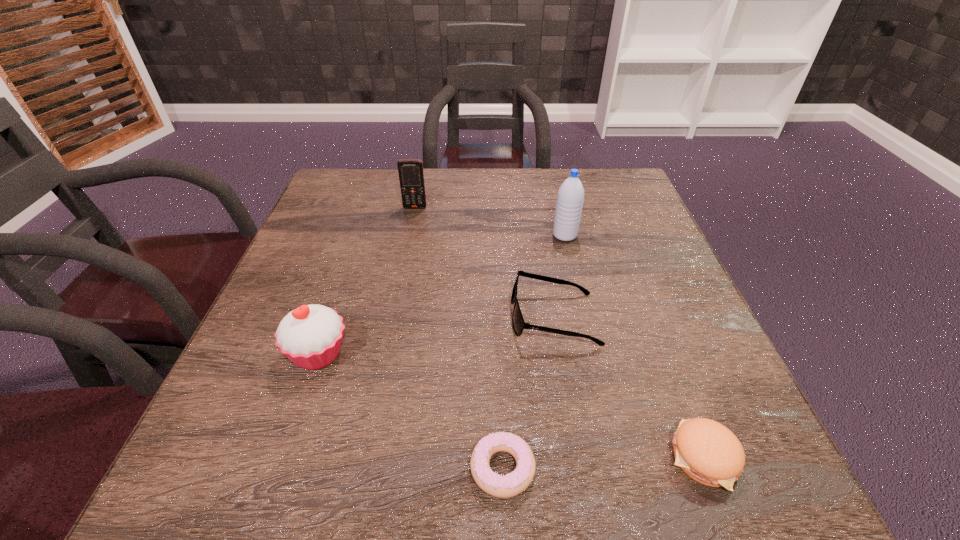
The height and width of the screenshot is (540, 960). In order to click on object that is the fourth closest one to the rightmost object in this screenshot , I will do `click(310, 336)`.

I want to click on object that is the fourth nearest to the cellular telephone, so click(512, 484).

The width and height of the screenshot is (960, 540). Identify the location of free spot that satisfies the following two spatial constraints: 1. on the screen of the cellular telephone; 2. on the right side of the doughnut. (364, 468).

The height and width of the screenshot is (540, 960). Find the location of `free space that satisfies the following two spatial constraints: 1. on the back side of the shortest object; 2. on the right side of the fifth nearest object`. free space that satisfies the following two spatial constraints: 1. on the back side of the shortest object; 2. on the right side of the fifth nearest object is located at coordinates (493, 235).